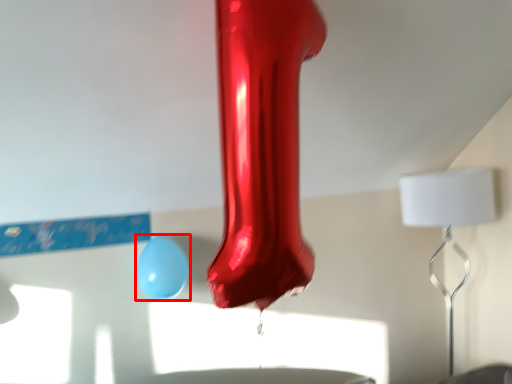
Question: From the image's perspective, what is the correct spatial positioning of balloon (annotated by the red box) in reference to lamp?

Choices:
 (A) below
 (B) above

Answer: (B)